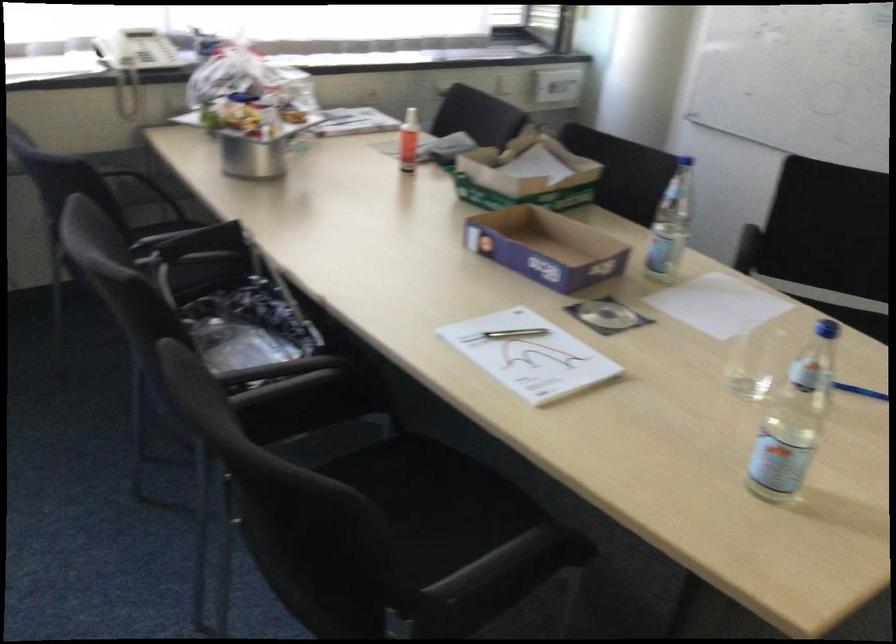
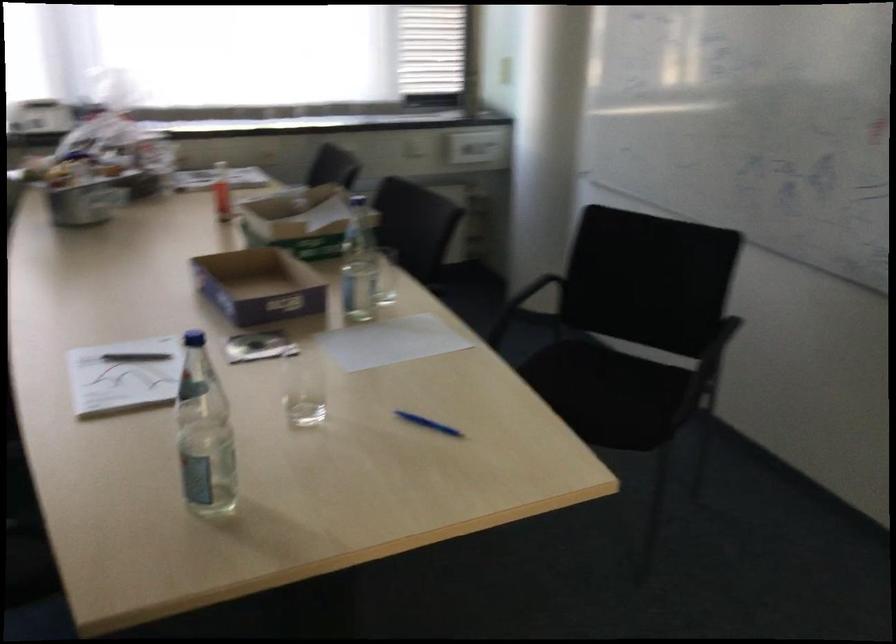
Question: Based on the continuous images, in which direction is the camera rotating? Reply with the corresponding letter.

Choices:
 (A) Left
 (B) Right
 (C) Up
 (D) Down

Answer: (A)